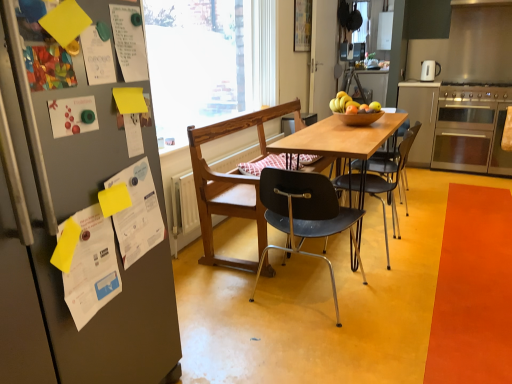
Find the location of a particular element. vacant region to the left of black plastic chair at center, the first chair when ordered from front to back is located at coordinates (219, 297).